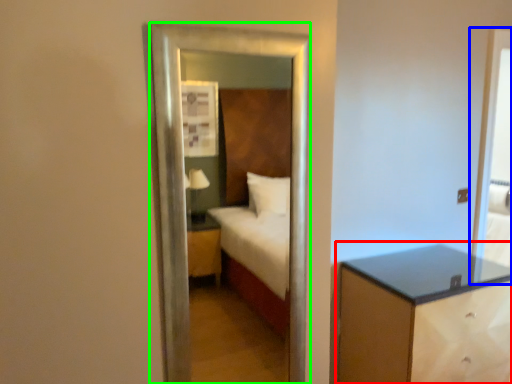
Question: Estimate the real-world distances between objects in this image. Which object is farther from nightstand (highlighted by a red box), screen door (highlighted by a blue box) or mirror (highlighted by a green box)?

Choices:
 (A) screen door
 (B) mirror

Answer: (B)